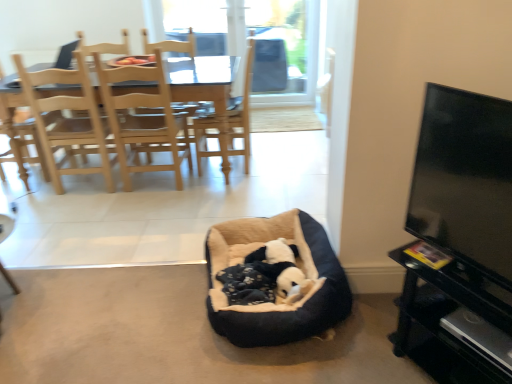
The image size is (512, 384). What are the coordinates of `vacant region under flat screen tv at right (from a real-world perspective)` in the screenshot? It's located at (451, 258).